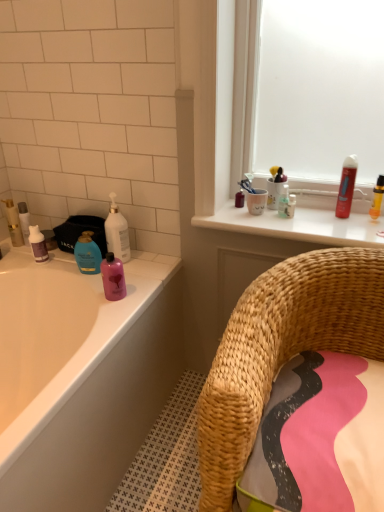
You are a GUI agent. You are given a task and a screenshot of the screen. Output one action in this format:
    pyautogui.click(x=<x>, y=<y>)
    Task: Click on the empty space that is in between translucent plastic toothbrush holder at upper center, the 5th toiletry when ordered from left to right, and red glossy mouthwash at upper right, the first mouthwash viewed from the right
    Image resolution: width=384 pixels, height=512 pixels.
    Given the screenshot: What is the action you would take?
    tap(312, 215)